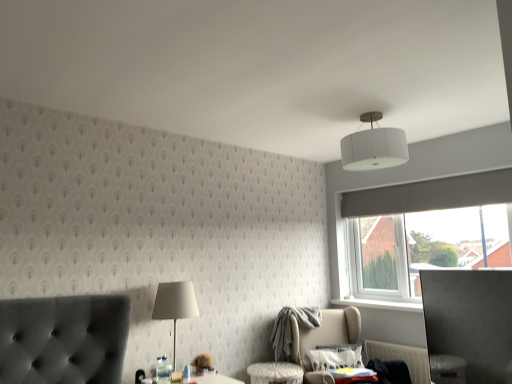
Consider the image. Measure the distance between point (169, 303) and camera.

Point (169, 303) and camera are 9.70 feet apart from each other.

Where is `beige fabric swivel chair at lower right`? The image size is (512, 384). beige fabric swivel chair at lower right is located at coordinates (324, 339).

This screenshot has width=512, height=384. Identify the location of white ribbed shade at upper center. (374, 146).

In the image, there is a white fabric lampshade at center. Identify the location of swivel chair below it (from the image's perspective). Image resolution: width=512 pixels, height=384 pixels. (324, 339).

Considering the sizes of white fabric lampshade at center and beige fabric swivel chair at lower right in the image, is white fabric lampshade at center wider or thinner than beige fabric swivel chair at lower right?

In the image, white fabric lampshade at center appears to be more narrow than beige fabric swivel chair at lower right.

Can you confirm if white fabric lampshade at center is taller than beige fabric swivel chair at lower right?

In fact, white fabric lampshade at center may be shorter than beige fabric swivel chair at lower right.

From the picture: Is white fabric lampshade at center turned away from beige fabric swivel chair at lower right?

No, white fabric lampshade at center is not facing the opposite direction of beige fabric swivel chair at lower right.

Who is taller, white plastic radiator at lower right or white ribbed shade at upper center?

white ribbed shade at upper center is taller.

Is white plastic radiator at lower right not inside white ribbed shade at upper center?

Yes, white plastic radiator at lower right is located beyond the bounds of white ribbed shade at upper center.

Is white plastic radiator at lower right oriented away from white ribbed shade at upper center?

white plastic radiator at lower right is not turned away from white ribbed shade at upper center.

Which is more to the left, white fabric lampshade at center or white ribbed shade at upper center?

white fabric lampshade at center.

Is white fabric lampshade at center beside white ribbed shade at upper center?

No, white fabric lampshade at center is not beside white ribbed shade at upper center.

Between point (168, 290) and point (355, 152), which one is positioned behind?

The point (168, 290) is behind.

Is white ribbed shade at upper center located within white fabric lampshade at center?

No, white ribbed shade at upper center is not inside white fabric lampshade at center.

Is white ribbed shade at upper center far from beige fabric swivel chair at lower right?

Yes, white ribbed shade at upper center and beige fabric swivel chair at lower right are quite far apart.

Is white ribbed shade at upper center closer to camera compared to beige fabric swivel chair at lower right?

Yes.

From a real-world perspective, is white ribbed shade at upper center above or below beige fabric swivel chair at lower right?

white ribbed shade at upper center is situated higher than beige fabric swivel chair at lower right in the real world.

Considering the relative positions of white ribbed shade at upper center and beige fabric swivel chair at lower right in the image provided, is white ribbed shade at upper center to the left of beige fabric swivel chair at lower right from the viewer's perspective?

No.

Based on the photo, are white plastic radiator at lower right and white fabric lampshade at center located far from each other?

Yes, white plastic radiator at lower right is far from white fabric lampshade at center.

Do you think white plastic radiator at lower right is within white fabric lampshade at center, or outside of it?

white plastic radiator at lower right is not enclosed by white fabric lampshade at center.

Is point (415, 351) positioned before point (159, 312)?

No, (415, 351) is behind (159, 312).

Consider the image. Can you tell me how much white plastic radiator at lower right and white fabric lampshade at center differ in facing direction?

88.2 degrees separate the facing orientations of white plastic radiator at lower right and white fabric lampshade at center.

Measure the distance between beige fabric swivel chair at lower right and white plastic radiator at lower right.

The distance of beige fabric swivel chair at lower right from white plastic radiator at lower right is 42.62 centimeters.

Considering the sizes of beige fabric swivel chair at lower right and white plastic radiator at lower right in the image, is beige fabric swivel chair at lower right taller or shorter than white plastic radiator at lower right?

Clearly, beige fabric swivel chair at lower right is taller compared to white plastic radiator at lower right.

Are beige fabric swivel chair at lower right and white plastic radiator at lower right beside each other?

No, beige fabric swivel chair at lower right is not in contact with white plastic radiator at lower right.

Which object is wider, beige fabric swivel chair at lower right or white plastic radiator at lower right?

beige fabric swivel chair at lower right.

Does beige fabric swivel chair at lower right turn towards white ribbed shade at upper center?

No.

From a real-world perspective, is beige fabric swivel chair at lower right above or below white ribbed shade at upper center?

From a real-world perspective, beige fabric swivel chair at lower right is physically below white ribbed shade at upper center.

Considering the sizes of objects beige fabric swivel chair at lower right and white ribbed shade at upper center in the image provided, who is wider, beige fabric swivel chair at lower right or white ribbed shade at upper center?

With larger width is beige fabric swivel chair at lower right.

Which point is more distant from viewer, [333,326] or [347,139]?

Positioned behind is point [333,326].

This screenshot has width=512, height=384. What are the coordinates of `table lamp positioned vertically above the beige fabric swivel chair at lower right (from a real-world perspective)` in the screenshot? It's located at (175, 305).

You are a GUI agent. You are given a task and a screenshot of the screen. Output one action in this format:
    pyautogui.click(x=<x>, y=<y>)
    Task: Click on the lamp above the white plastic radiator at lower right (from the image's perspective)
    
    Given the screenshot: What is the action you would take?
    pyautogui.click(x=374, y=146)

Looking at the image, which one is located further to white plastic radiator at lower right, white ribbed shade at upper center or white fabric lampshade at center?

white fabric lampshade at center is positioned further to the anchor white plastic radiator at lower right.

Considering their positions, is white fabric lampshade at center positioned further to white ribbed shade at upper center than white plastic radiator at lower right?

The object further to white ribbed shade at upper center is white plastic radiator at lower right.

Which object lies further to the anchor point white plastic radiator at lower right, white ribbed shade at upper center or beige fabric swivel chair at lower right?

The object further to white plastic radiator at lower right is white ribbed shade at upper center.

Considering their positions, is white fabric lampshade at center positioned further to beige fabric swivel chair at lower right than white ribbed shade at upper center?

Based on the image, white ribbed shade at upper center appears to be further to beige fabric swivel chair at lower right.

From the image, which object appears to be nearer to white fabric lampshade at center, white ribbed shade at upper center or white plastic radiator at lower right?

Based on the image, white ribbed shade at upper center appears to be nearer to white fabric lampshade at center.

Looking at the image, which one is located closer to white ribbed shade at upper center, white plastic radiator at lower right or white fabric lampshade at center?

Among the two, white fabric lampshade at center is located nearer to white ribbed shade at upper center.

Considering their positions, is white plastic radiator at lower right positioned closer to white ribbed shade at upper center than beige fabric swivel chair at lower right?

Based on the image, beige fabric swivel chair at lower right appears to be nearer to white ribbed shade at upper center.

When comparing their distances from beige fabric swivel chair at lower right, does white plastic radiator at lower right or white ribbed shade at upper center seem closer?

white plastic radiator at lower right is positioned closer to the anchor beige fabric swivel chair at lower right.

You are a GUI agent. You are given a task and a screenshot of the screen. Output one action in this format:
    pyautogui.click(x=<x>, y=<y>)
    Task: Click on the swivel chair that lies between white ribbed shade at upper center and white plastic radiator at lower right from top to bottom
    Image resolution: width=512 pixels, height=384 pixels.
    Given the screenshot: What is the action you would take?
    pyautogui.click(x=324, y=339)

Find the location of a particular element. swivel chair between white fabric lampshade at center and white plastic radiator at lower right from left to right is located at coordinates (324, 339).

You are a GUI agent. You are given a task and a screenshot of the screen. Output one action in this format:
    pyautogui.click(x=<x>, y=<y>)
    Task: Click on the table lamp between white ribbed shade at upper center and beige fabric swivel chair at lower right in the vertical direction
    
    Given the screenshot: What is the action you would take?
    pyautogui.click(x=175, y=305)

Where is `lamp situated between white fabric lampshade at center and white plastic radiator at lower right from left to right`? The height and width of the screenshot is (384, 512). lamp situated between white fabric lampshade at center and white plastic radiator at lower right from left to right is located at coordinates (374, 146).